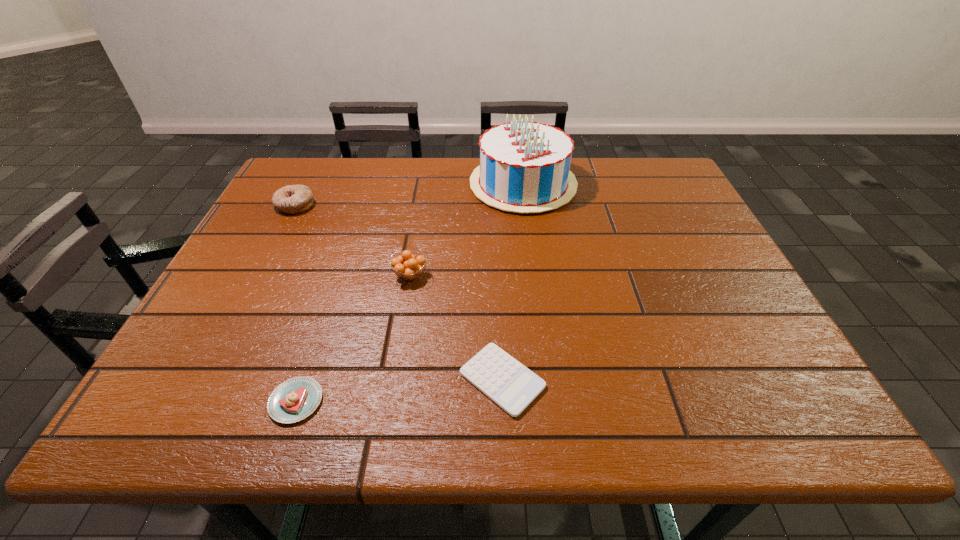
At what (x,y) coordinates should I click in order to perform the action: click on vacant region between the second object from left to right and the third object from left to right. Please return your answer as a coordinate pair (x, y). This screenshot has width=960, height=540. Looking at the image, I should click on (353, 339).

In order to click on free area in between the pastry and the leftmost object in this screenshot , I will do `click(296, 303)`.

Identify the location of free space between the third nearest object and the leftmost object. The width and height of the screenshot is (960, 540). (353, 240).

Find the location of a particular element. free space between the tallest object and the shortest object is located at coordinates (513, 282).

Identify which object is located as the nearest to the third farthest object. Please provide its 2D coordinates. Your answer should be formatted as a tuple, i.e. [(x, y)], where the tuple contains the x and y coordinates of a point satisfying the conditions above.

[(512, 386)]

The width and height of the screenshot is (960, 540). What are the coordinates of `object that is the closest one to the birthday cake` in the screenshot? It's located at (408, 267).

The height and width of the screenshot is (540, 960). What are the coordinates of `free space in the image that satisfies the following two spatial constraints: 1. on the back side of the shortest object; 2. on the left side of the second object from left to right` in the screenshot? It's located at (303, 380).

This screenshot has width=960, height=540. I want to click on vacant point that satisfies the following two spatial constraints: 1. on the back side of the second shortest object; 2. on the left side of the calculator, so click(303, 380).

At what (x,y) coordinates should I click in order to perform the action: click on blank area in the image that satisfies the following two spatial constraints: 1. on the front side of the doughnut; 2. on the right side of the pastry. Please return your answer as a coordinate pair (x, y). Looking at the image, I should click on (193, 401).